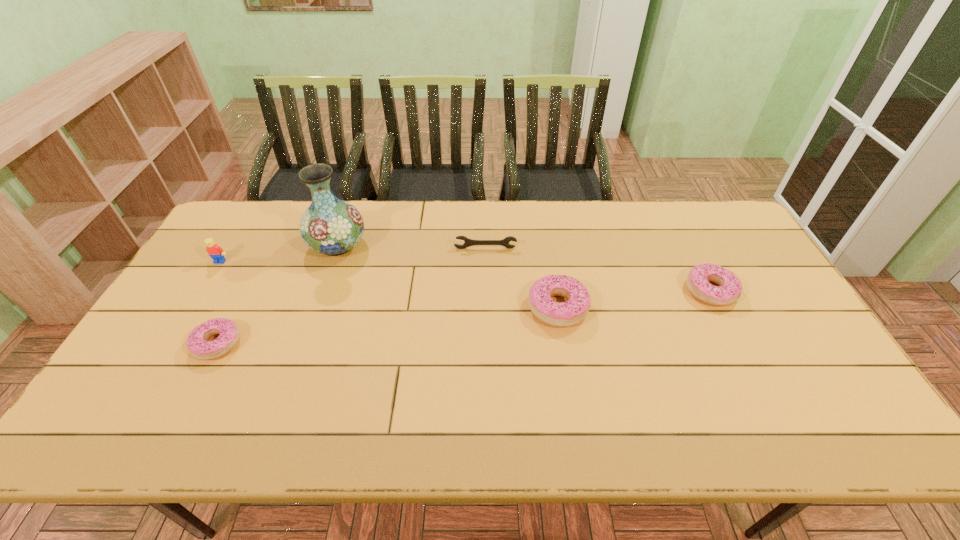
What are the coordinates of `free location at the far edge` in the screenshot? It's located at click(x=543, y=204).

Locate an element on the screen. Image resolution: width=960 pixels, height=540 pixels. free point at the near edge is located at coordinates (422, 392).

The height and width of the screenshot is (540, 960). In order to click on free location at the left edge of the desktop in this screenshot , I will do `click(238, 265)`.

Identify the location of vacant space at the right edge. Image resolution: width=960 pixels, height=540 pixels. (786, 360).

Locate an element on the screen. free space at the far left corner of the desktop is located at coordinates (225, 225).

The image size is (960, 540). I want to click on free space at the near left corner of the desktop, so click(x=175, y=376).

Locate an element on the screen. vacant space at the far right corner of the desktop is located at coordinates (693, 226).

The width and height of the screenshot is (960, 540). In order to click on vacant space at the near right corner of the desktop in this screenshot , I will do [795, 391].

Locate an element on the screen. The width and height of the screenshot is (960, 540). free space that is in between the second doughnut from right to left and the fourth object from right to left is located at coordinates (447, 276).

Find the location of `free space between the second object from right to left and the rightmost doughnut`. free space between the second object from right to left and the rightmost doughnut is located at coordinates (635, 299).